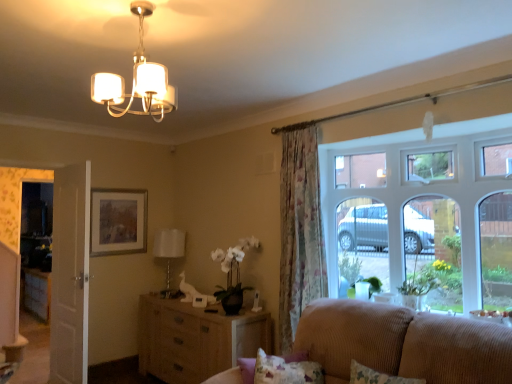
This screenshot has width=512, height=384. I want to click on free space above matte white chandelier at upper center, the first lamp viewed from the top (from a real-world perspective), so click(155, 8).